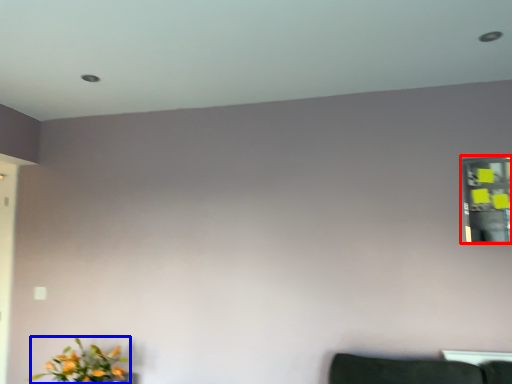
Question: Which object is further to the camera taking this photo, mirror (highlighted by a red box) or flower (highlighted by a blue box)?

Choices:
 (A) mirror
 (B) flower

Answer: (A)